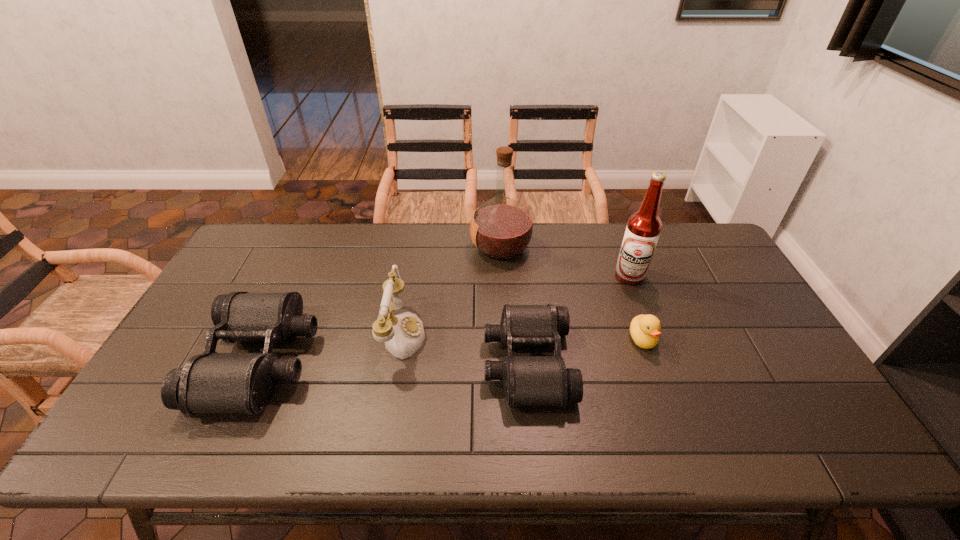
At what (x,y) coordinates should I click in order to perform the action: click on the taller binoculars. Please return your answer as a coordinate pair (x, y). This screenshot has width=960, height=540. Looking at the image, I should click on (211, 382).

This screenshot has height=540, width=960. In order to click on the left binoculars in this screenshot , I will do `click(211, 382)`.

Locate an element on the screen. The image size is (960, 540). the shorter binoculars is located at coordinates (527, 380).

Identify the location of liquor. (501, 228).

This screenshot has width=960, height=540. I want to click on alcohol, so click(643, 228).

Find the location of a particular element. This screenshot has width=960, height=540. the third tallest object is located at coordinates (403, 334).

This screenshot has width=960, height=540. I want to click on the fifth object from right to left, so click(403, 334).

The width and height of the screenshot is (960, 540). What are the coordinates of `duckling` in the screenshot? It's located at (645, 329).

You are a GUI agent. You are given a task and a screenshot of the screen. Output one action in this format:
    pyautogui.click(x=<x>, y=<y>)
    Task: Click on the vacant area situated 0.340m through the eyepieces of the taller binoculars
    The width and height of the screenshot is (960, 540).
    Given the screenshot: What is the action you would take?
    pyautogui.click(x=440, y=360)

This screenshot has width=960, height=540. What are the coordinates of `free location located through the eyepieces of the shorter binoculars` in the screenshot? It's located at (355, 362).